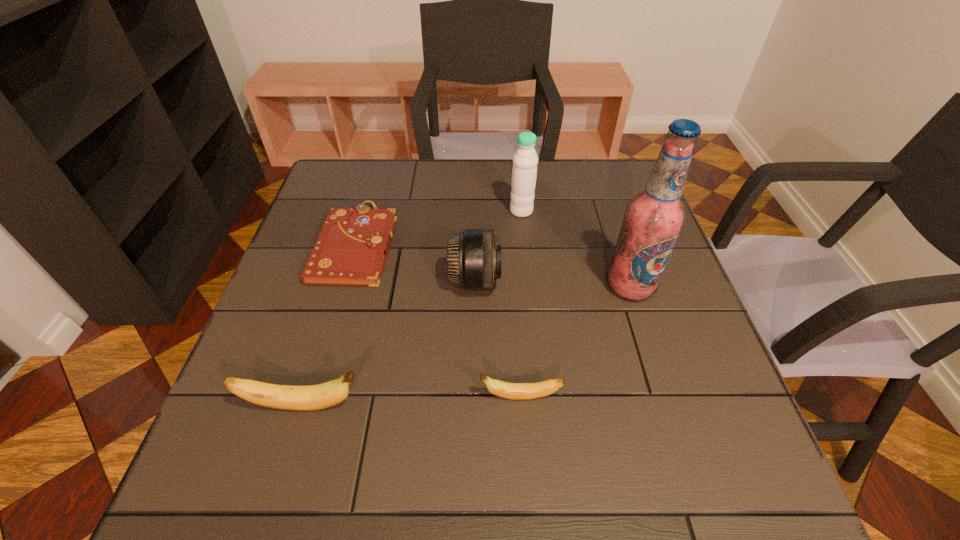
Identify the location of object located at the right edge. This screenshot has width=960, height=540. (653, 219).

Identify the location of object located at the near left corner. This screenshot has height=540, width=960. (289, 397).

In the image, there is a desktop. Where is `vacant space at the far edge`? This screenshot has height=540, width=960. vacant space at the far edge is located at coordinates (389, 197).

Image resolution: width=960 pixels, height=540 pixels. I want to click on vacant space at the near edge, so click(x=434, y=435).

The image size is (960, 540). Find the location of `vacant space at the left edge`. vacant space at the left edge is located at coordinates (312, 226).

I want to click on vacant space at the right edge of the desktop, so click(625, 301).

The image size is (960, 540). Find the location of `blank area at the far left corner`. blank area at the far left corner is located at coordinates (381, 163).

In order to click on vacant space at the far right corner of the desktop in this screenshot , I will do `click(624, 160)`.

Find the location of a particular element. The image size is (960, 540). vacant space that's between the shorter banana and the tallest object is located at coordinates (575, 342).

Locate an element on the screen. The width and height of the screenshot is (960, 540). vacant space that's between the notebook and the taller banana is located at coordinates (330, 325).